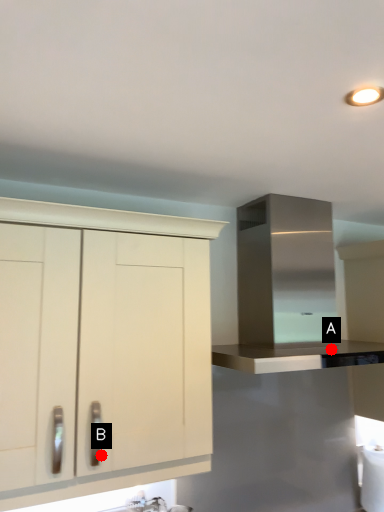
Question: Two points are circled on the image, labeled by A and B beside each circle. Among these points, which one is farthest from the camera?

Choices:
 (A) A is further
 (B) B is further

Answer: (A)